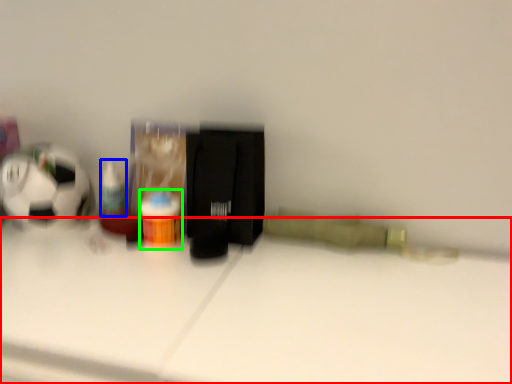
Question: Considering the real-world distances, which object is closest to table (highlighted by a red box)? toiletry (highlighted by a blue box) or bottle (highlighted by a green box).

Choices:
 (A) toiletry
 (B) bottle

Answer: (B)